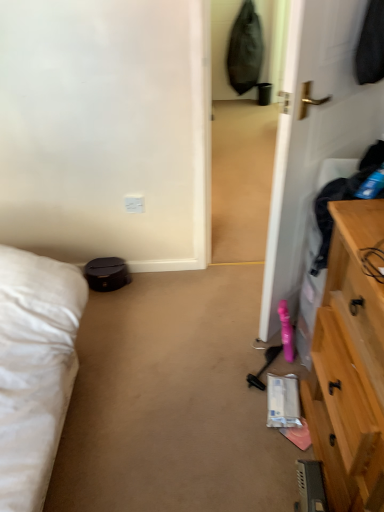
The width and height of the screenshot is (384, 512). What do you see at coordinates (134, 203) in the screenshot?
I see `white plastic electric outlet at center` at bounding box center [134, 203].

Locate an element on the screen. The width and height of the screenshot is (384, 512). white plastic electric outlet at center is located at coordinates (134, 203).

In order to face white plastic electric outlet at center, should I rotate leftwards or rightwards?

To align with it, rotate left about 7.960°.

What are the coordinates of `white glossy door at right` in the screenshot? It's located at (313, 134).

What do you see at coordinates (313, 134) in the screenshot?
I see `white glossy door at right` at bounding box center [313, 134].

What is the approximate width of white glossy door at right?

It is 14.81 centimeters.

You are a GUI agent. You are given a task and a screenshot of the screen. Output one action in this format:
    pyautogui.click(x=<x>, y=<y>)
    Task: Click on the white plastic electric outlet at center
    Image resolution: width=384 pixels, height=512 pixels.
    Given the screenshot: What is the action you would take?
    pyautogui.click(x=134, y=203)

Can you confirm if white plastic electric outlet at center is positioned to the right of white glossy door at right?

No, white plastic electric outlet at center is not to the right of white glossy door at right.

Which is behind, white plastic electric outlet at center or white glossy door at right?

white plastic electric outlet at center is further away from the camera.

Which is nearer, (142,207) or (264,321)?

Point (142,207) is farther from the camera than point (264,321).

From the image's perspective, would you say white plastic electric outlet at center is shown under white glossy door at right?

Yes, from the image's perspective, white plastic electric outlet at center is beneath white glossy door at right.

From a real-world perspective, does white plastic electric outlet at center sit lower than white glossy door at right?

Yes, from a real-world perspective, white plastic electric outlet at center is beneath white glossy door at right.

Does white plastic electric outlet at center have a greater width compared to white glossy door at right?

No.

Does white plastic electric outlet at center have a lesser height compared to white glossy door at right?

Yes, white plastic electric outlet at center is shorter than white glossy door at right.

Considering the relative sizes of white plastic electric outlet at center and white glossy door at right in the image provided, is white plastic electric outlet at center bigger than white glossy door at right?

Incorrect, white plastic electric outlet at center is not larger than white glossy door at right.

Can white glossy door at right be found inside white plastic electric outlet at center?

No, white glossy door at right is not a part of white plastic electric outlet at center.

Is white plastic electric outlet at center far away from white glossy door at right?

No, white plastic electric outlet at center is not far away from white glossy door at right.

Looking at this image, is white plastic electric outlet at center facing away from white glossy door at right?

No, white plastic electric outlet at center is not facing away from white glossy door at right.

How different are the orientations of white plastic electric outlet at center and white glossy door at right in degrees?

white plastic electric outlet at center and white glossy door at right are facing 136 degrees away from each other.

The height and width of the screenshot is (512, 384). Find the location of `electric outlet below the white glossy door at right (from the image's perspective)`. electric outlet below the white glossy door at right (from the image's perspective) is located at coordinates (134, 203).

Is white glossy door at right to the right of white plastic electric outlet at center from the viewer's perspective?

Indeed, white glossy door at right is positioned on the right side of white plastic electric outlet at center.

Who is more distant, white glossy door at right or white plastic electric outlet at center?

Positioned behind is white plastic electric outlet at center.

Which point is more distant from viewer, (376, 114) or (140, 203)?

Point (140, 203)

From the image's perspective, is white glossy door at right located above white plastic electric outlet at center?

Indeed, from the image's perspective, white glossy door at right is shown above white plastic electric outlet at center.

From a real-world perspective, between white glossy door at right and white plastic electric outlet at center, who is vertically higher?

white glossy door at right is physically above.

Can you confirm if white glossy door at right is thinner than white plastic electric outlet at center?

Incorrect, the width of white glossy door at right is not less than that of white plastic electric outlet at center.

Is white glossy door at right taller or shorter than white plastic electric outlet at center?

In the image, white glossy door at right appears to be taller than white plastic electric outlet at center.

Consider the image. Is white glossy door at right bigger or smaller than white plastic electric outlet at center?

In the image, white glossy door at right appears to be larger than white plastic electric outlet at center.

Is white plastic electric outlet at center located within white glossy door at right?

No, white plastic electric outlet at center is not inside white glossy door at right.

Consider the image. Is white glossy door at right in contact with white plastic electric outlet at center?

No, white glossy door at right is not touching white plastic electric outlet at center.

Consider the image. Is white plastic electric outlet at center at the back of white glossy door at right?

No, white glossy door at right is not facing away from white plastic electric outlet at center.

Can you tell me how much white glossy door at right and white plastic electric outlet at center differ in facing direction?

There is a 136-degree angle between the facing directions of white glossy door at right and white plastic electric outlet at center.

Image resolution: width=384 pixels, height=512 pixels. In the image, there is a white glossy door at right. Identify the location of electric outlet below it (from the image's perspective). (134, 203).

The width and height of the screenshot is (384, 512). I want to click on door on the right of the white plastic electric outlet at center, so click(x=313, y=134).

Locate an element on the screen. door in front of the white plastic electric outlet at center is located at coordinates (313, 134).